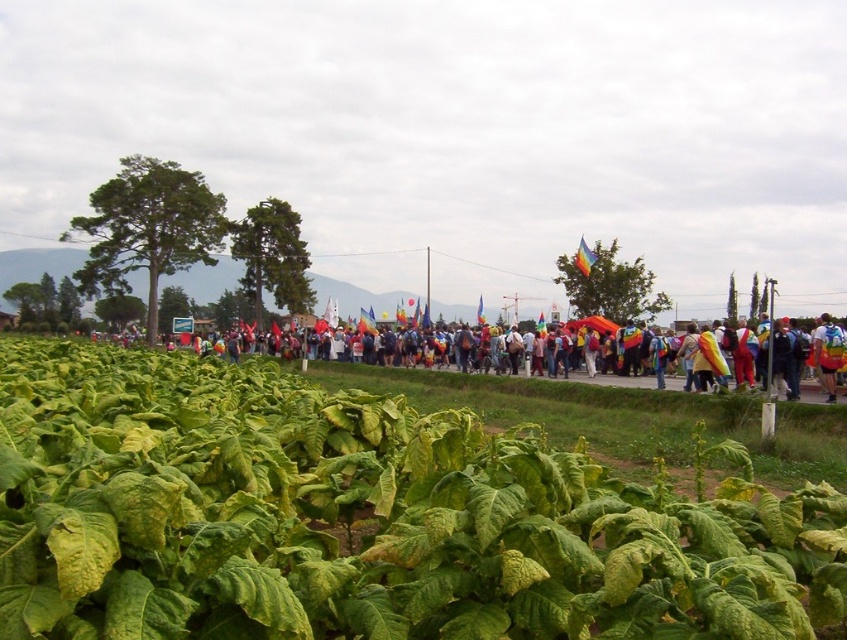
Question: Does green leafy plant at center appear under rainbow flag at center?

Choices:
 (A) no
 (B) yes

Answer: (B)

Question: Which object appears farthest from the camera in this image?

Choices:
 (A) green leafy plant at center
 (B) rainbow flag at center

Answer: (B)

Question: Can you confirm if green leafy plant at center is positioned below rainbow flag at center?

Choices:
 (A) no
 (B) yes

Answer: (B)

Question: Among these objects, which one is nearest to the camera?

Choices:
 (A) green leafy plant at center
 (B) rainbow flag at center

Answer: (A)

Question: Does green leafy plant at center appear on the left side of rainbow flag at center?

Choices:
 (A) yes
 (B) no

Answer: (B)